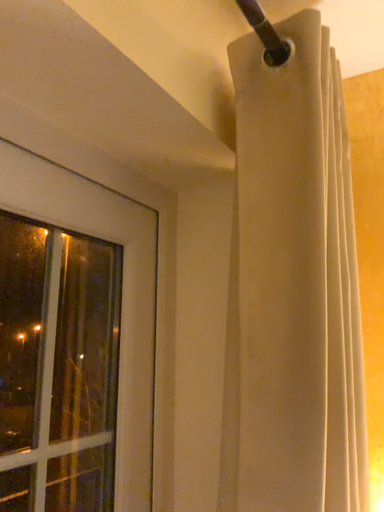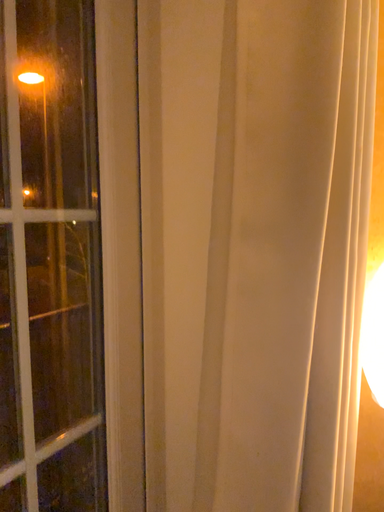
Question: Which way did the camera rotate in the video?

Choices:
 (A) rotated downward
 (B) rotated upward

Answer: (A)